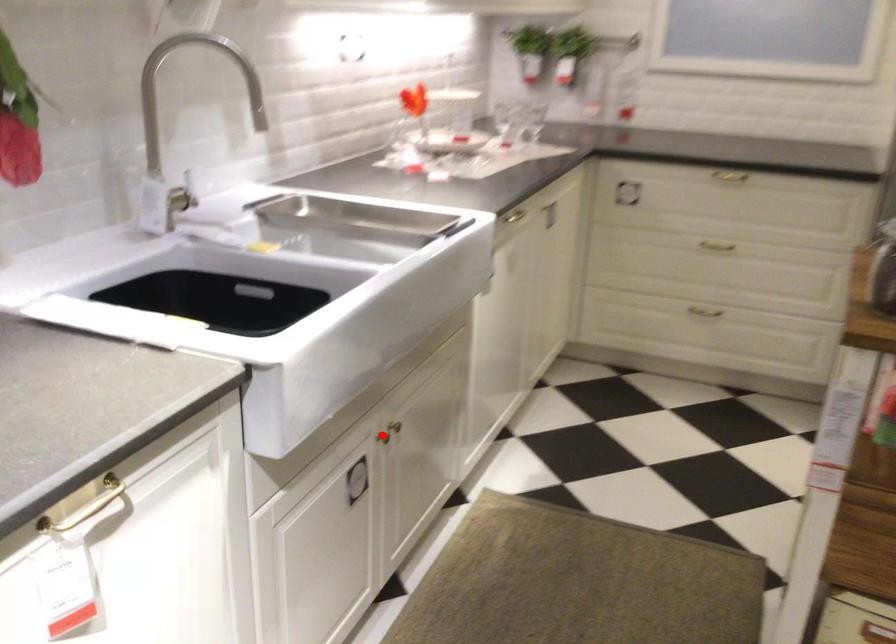
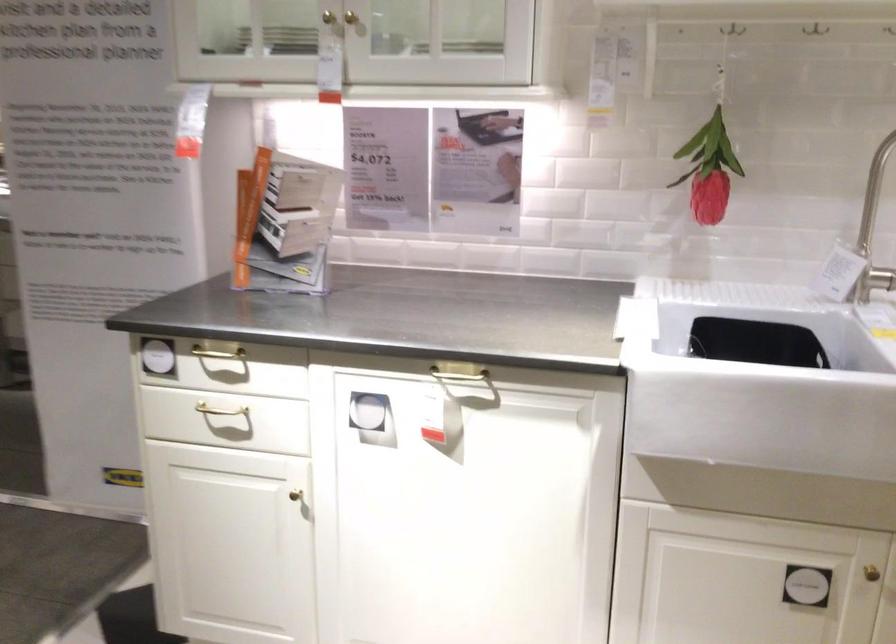
The point at the highlighted location is marked in the first image. Where is the corresponding point in the second image?

(871, 573)